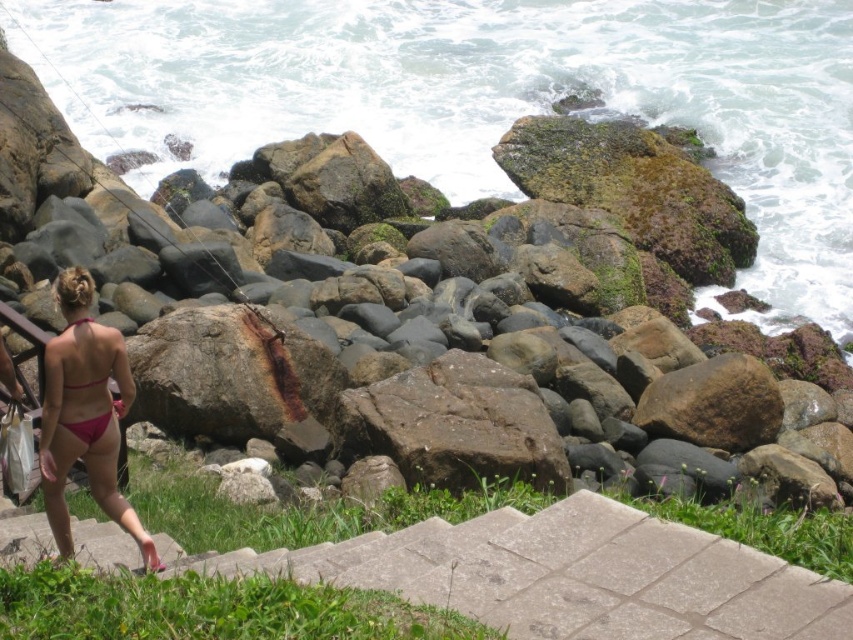
Question: Observing the image, what is the correct spatial positioning of rusty metal rock at center in reference to pink fabric bikini at lower left?

Choices:
 (A) above
 (B) below

Answer: (A)

Question: Does pink fabric bikini at lower left have a smaller size compared to pink matte bikini at lower left?

Choices:
 (A) yes
 (B) no

Answer: (B)

Question: Which of these objects is positioned farthest from the concrete steps at lower center?

Choices:
 (A) pink matte bikini at lower left
 (B) pink fabric bikini at lower left

Answer: (A)

Question: Which of the following is the closest to the observer?

Choices:
 (A) pink fabric bikini at lower left
 (B) concrete steps at lower center
 (C) pink matte bikini at lower left
 (D) rusty metal rock at center

Answer: (B)

Question: Which of these objects is positioned farthest from the pink fabric bikini at lower left?

Choices:
 (A) pink matte bikini at lower left
 (B) concrete steps at lower center

Answer: (B)

Question: From the image, what is the correct spatial relationship of concrete steps at lower center in relation to pink matte bikini at lower left?

Choices:
 (A) below
 (B) above

Answer: (A)